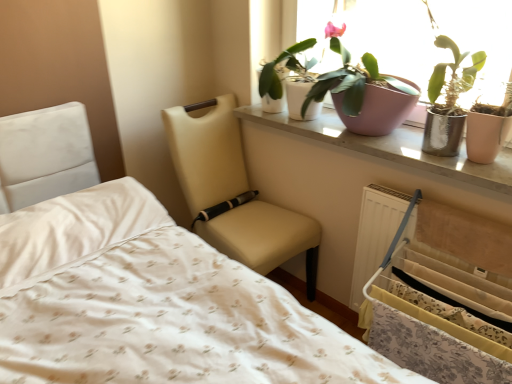
Question: Is pink matte pot at upper center, the first houseplant from the right, outside of white fabric bed frame at lower right?

Choices:
 (A) yes
 (B) no

Answer: (A)

Question: Does pink matte pot at upper center, marked as the 2th houseplant in a left-to-right arrangement, come behind white fabric bed frame at lower right?

Choices:
 (A) no
 (B) yes

Answer: (B)

Question: Is pink matte pot at upper center, the first houseplant from the right, aimed at white fabric bed frame at lower right?

Choices:
 (A) no
 (B) yes

Answer: (A)

Question: Is pink matte pot at upper center, the first houseplant from the right, at the right side of white fabric bed frame at lower right?

Choices:
 (A) no
 (B) yes

Answer: (A)

Question: Is pink matte pot at upper center, marked as the 2th houseplant in a left-to-right arrangement, directly adjacent to white fabric bed frame at lower right?

Choices:
 (A) yes
 (B) no

Answer: (B)

Question: Is beige leather chair at center inside the boundaries of pink ceramic window sill at upper center, or outside?

Choices:
 (A) outside
 (B) inside

Answer: (A)

Question: From the image's perspective, is beige leather chair at center positioned above or below pink ceramic window sill at upper center?

Choices:
 (A) above
 (B) below

Answer: (B)

Question: Considering the positions of point (232, 132) and point (398, 155), is point (232, 132) closer or farther from the camera than point (398, 155)?

Choices:
 (A) closer
 (B) farther

Answer: (B)

Question: Considering the positions of beige leather chair at center and pink ceramic window sill at upper center in the image, is beige leather chair at center bigger or smaller than pink ceramic window sill at upper center?

Choices:
 (A) small
 (B) big

Answer: (B)

Question: Do you think white glossy pot at upper center, marked as the first houseplant in a left-to-right arrangement, is within white fabric bed frame at lower right, or outside of it?

Choices:
 (A) inside
 (B) outside

Answer: (B)

Question: From a real-world perspective, is white glossy pot at upper center, marked as the first houseplant in a left-to-right arrangement, positioned above or below white fabric bed frame at lower right?

Choices:
 (A) above
 (B) below

Answer: (A)

Question: Visually, is white glossy pot at upper center, the second houseplant viewed from the right, positioned to the left or to the right of white fabric bed frame at lower right?

Choices:
 (A) right
 (B) left

Answer: (B)

Question: Looking at their shapes, would you say white glossy pot at upper center, the second houseplant viewed from the right, is wider or thinner than white fabric bed frame at lower right?

Choices:
 (A) thin
 (B) wide

Answer: (A)

Question: From the image's perspective, is white fabric bed frame at lower right positioned above or below white glossy pot at upper center, marked as the first houseplant in a left-to-right arrangement?

Choices:
 (A) above
 (B) below

Answer: (B)

Question: Looking at the image, does white fabric bed frame at lower right seem bigger or smaller compared to white glossy pot at upper center, marked as the first houseplant in a left-to-right arrangement?

Choices:
 (A) big
 (B) small

Answer: (A)